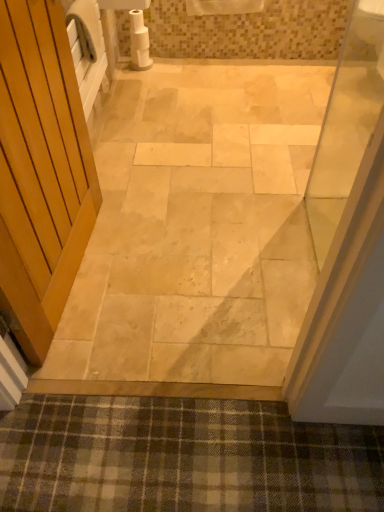
Where is `vacant area on top of plaid fabric bath mat at lower center (from a real-world perspective)`? Image resolution: width=384 pixels, height=512 pixels. vacant area on top of plaid fabric bath mat at lower center (from a real-world perspective) is located at coordinates (193, 450).